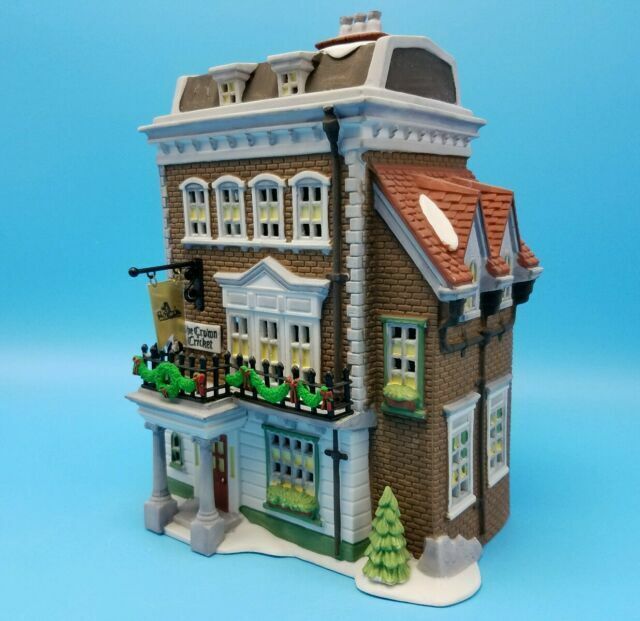
This screenshot has width=640, height=621. I want to click on wreath, so click(x=166, y=379).